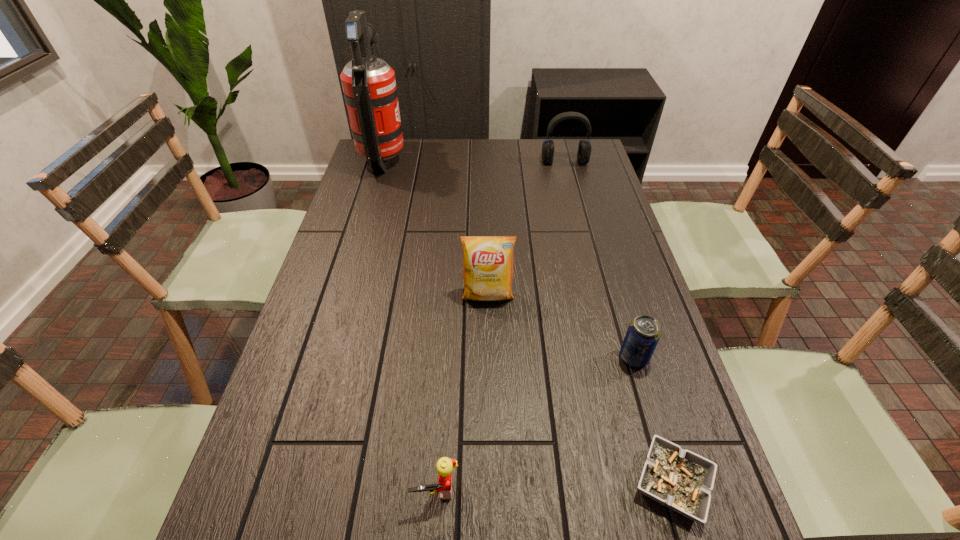
This screenshot has width=960, height=540. In order to click on vacant point that satisfies the following two spatial constraints: 1. on the headband of the headset; 2. on the right side of the shortest object in this screenshot , I will do `click(648, 483)`.

This screenshot has width=960, height=540. I want to click on vacant region that satisfies the following two spatial constraints: 1. on the back side of the soda; 2. on the front label side of the leftmost object, so click(576, 159).